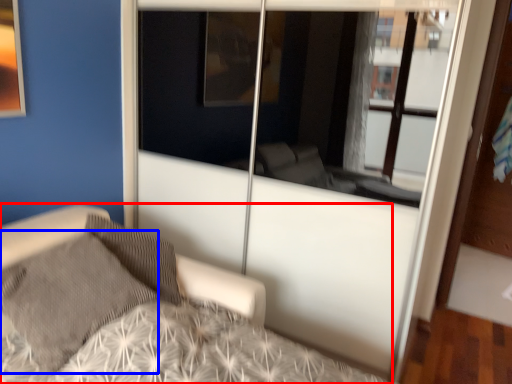
Question: Which point is further to the camera, bed (highlighted by a red box) or pillow (highlighted by a blue box)?

Choices:
 (A) bed
 (B) pillow

Answer: (B)